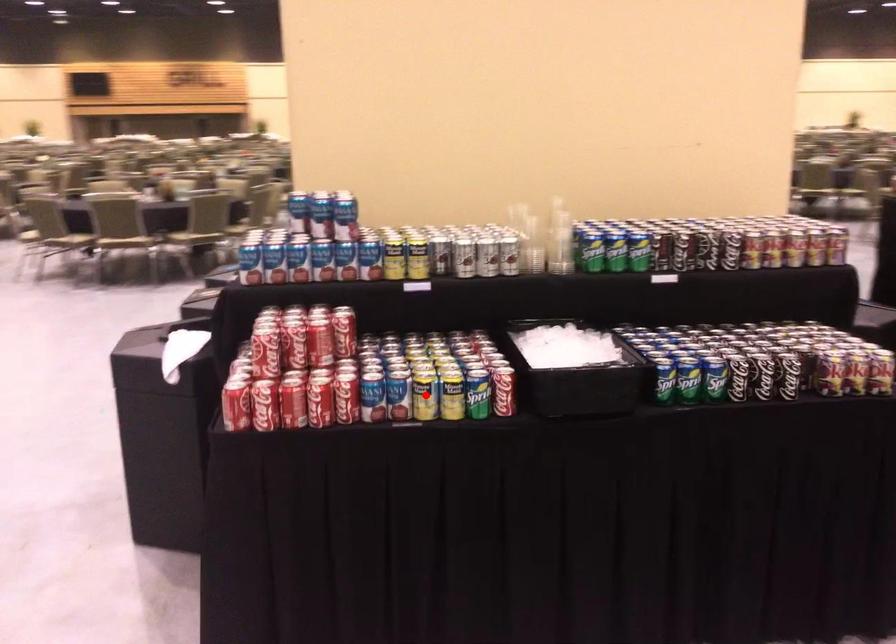
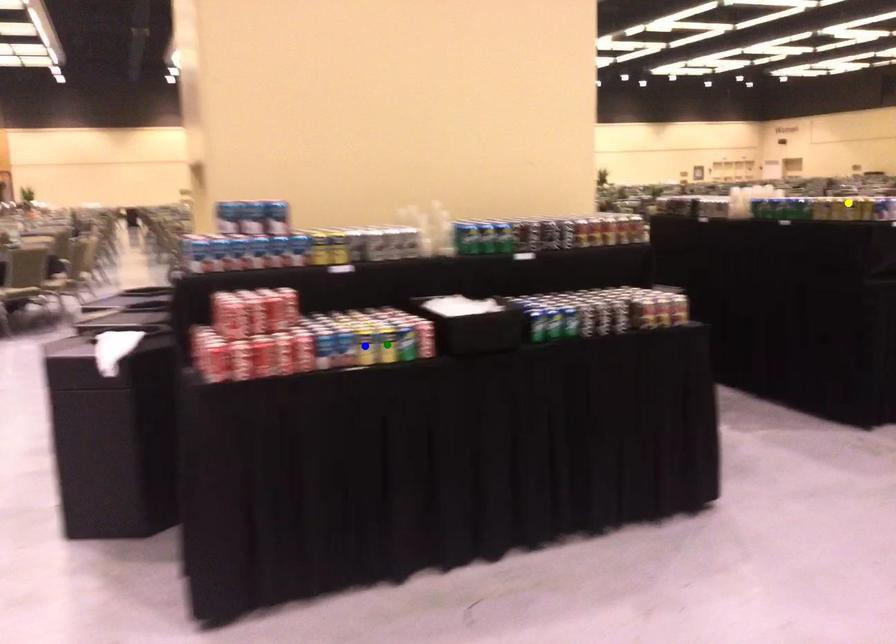
Question: I am providing you with two images of the same scene from different viewpoints. A red point is marked on the first image. You are given multiple points on the second image. Which mark in image 2 goes with the point in image 1?

Choices:
 (A) yellow point
 (B) green point
 (C) blue point

Answer: (C)